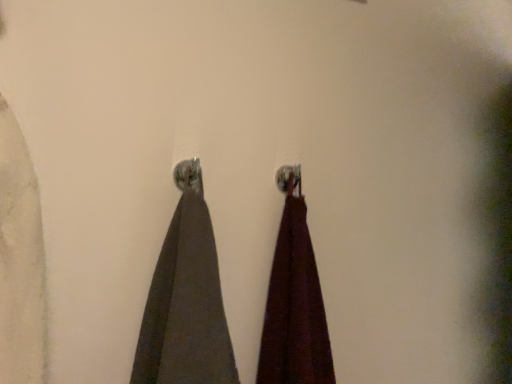
At what (x,y) coordinates should I click in order to perform the action: click on burgundy fabric at center, the 1th curtain viewed from the right. Please return your answer as a coordinate pair (x, y). This screenshot has height=384, width=512. Looking at the image, I should click on (294, 301).

What is the approximate height of burgundy fabric at center, the 1th curtain viewed from the right?

It is 47.63 centimeters.

Describe the element at coordinates (294, 301) in the screenshot. The height and width of the screenshot is (384, 512). I see `burgundy fabric at center, the second curtain in the left-to-right sequence` at that location.

What do you see at coordinates (186, 299) in the screenshot?
I see `dark gray fabric at center, acting as the second curtain starting from the right` at bounding box center [186, 299].

How much space does dark gray fabric at center, acting as the second curtain starting from the right, occupy horizontally?

dark gray fabric at center, acting as the second curtain starting from the right, is 4.98 inches wide.

Identify the location of dark gray fabric at center, acting as the second curtain starting from the right. (186, 299).

Where is `burgundy fabric at center, the second curtain in the left-to-right sequence`? This screenshot has width=512, height=384. burgundy fabric at center, the second curtain in the left-to-right sequence is located at coordinates (294, 301).

Considering the positions of objects dark gray fabric at center, acting as the second curtain starting from the right, and burgundy fabric at center, the 1th curtain viewed from the right, in the image provided, who is more to the left, dark gray fabric at center, acting as the second curtain starting from the right, or burgundy fabric at center, the 1th curtain viewed from the right,?

From the viewer's perspective, dark gray fabric at center, acting as the second curtain starting from the right, appears more on the left side.

Is the depth of dark gray fabric at center, acting as the second curtain starting from the right, greater than that of burgundy fabric at center, the 1th curtain viewed from the right?

No, it is in front of burgundy fabric at center, the 1th curtain viewed from the right.

Is point (177, 257) in front of point (323, 331)?

That is True.

From the image's perspective, is dark gray fabric at center, acting as the second curtain starting from the right, over burgundy fabric at center, the second curtain in the left-to-right sequence?

Yes, from the image's perspective, dark gray fabric at center, acting as the second curtain starting from the right, is on top of burgundy fabric at center, the second curtain in the left-to-right sequence.

From a real-world perspective, is dark gray fabric at center, acting as the second curtain starting from the right, physically above burgundy fabric at center, the second curtain in the left-to-right sequence?

Indeed, from a real-world perspective, dark gray fabric at center, acting as the second curtain starting from the right, stands above burgundy fabric at center, the second curtain in the left-to-right sequence.

Which of these two, dark gray fabric at center, acting as the second curtain starting from the right, or burgundy fabric at center, the second curtain in the left-to-right sequence, is thinner?

dark gray fabric at center, acting as the second curtain starting from the right, is thinner.

Which of these two, dark gray fabric at center, the first curtain in the left-to-right sequence, or burgundy fabric at center, the second curtain in the left-to-right sequence, stands taller?

Standing taller between the two is burgundy fabric at center, the second curtain in the left-to-right sequence.

Looking at this image, looking at the image, does dark gray fabric at center, acting as the second curtain starting from the right, seem bigger or smaller compared to burgundy fabric at center, the second curtain in the left-to-right sequence?

dark gray fabric at center, acting as the second curtain starting from the right, is bigger than burgundy fabric at center, the second curtain in the left-to-right sequence.

Is dark gray fabric at center, acting as the second curtain starting from the right, situated inside burgundy fabric at center, the second curtain in the left-to-right sequence, or outside?

The correct answer is: outside.

Consider the image. Can you see dark gray fabric at center, acting as the second curtain starting from the right, touching burgundy fabric at center, the 1th curtain viewed from the right?

No, dark gray fabric at center, acting as the second curtain starting from the right, is not next to burgundy fabric at center, the 1th curtain viewed from the right.

Is dark gray fabric at center, the first curtain in the left-to-right sequence, oriented away from burgundy fabric at center, the 1th curtain viewed from the right?

No, burgundy fabric at center, the 1th curtain viewed from the right, is not at the back of dark gray fabric at center, the first curtain in the left-to-right sequence.

Can you tell me how much dark gray fabric at center, the first curtain in the left-to-right sequence, and burgundy fabric at center, the second curtain in the left-to-right sequence, differ in facing direction?

0.00046 degrees separate the facing orientations of dark gray fabric at center, the first curtain in the left-to-right sequence, and burgundy fabric at center, the second curtain in the left-to-right sequence.

Locate an element on the screen. This screenshot has width=512, height=384. curtain below the dark gray fabric at center, acting as the second curtain starting from the right (from the image's perspective) is located at coordinates (294, 301).

Between burgundy fabric at center, the second curtain in the left-to-right sequence, and dark gray fabric at center, acting as the second curtain starting from the right, which one appears on the left side from the viewer's perspective?

From the viewer's perspective, dark gray fabric at center, acting as the second curtain starting from the right, appears more on the left side.

Who is more distant, burgundy fabric at center, the 1th curtain viewed from the right, or dark gray fabric at center, the first curtain in the left-to-right sequence?

Positioned behind is burgundy fabric at center, the 1th curtain viewed from the right.

Does point (295, 322) appear closer or farther from the camera than point (177, 365)?

Point (295, 322).

From the image's perspective, which one is positioned lower, burgundy fabric at center, the 1th curtain viewed from the right, or dark gray fabric at center, the first curtain in the left-to-right sequence?

burgundy fabric at center, the 1th curtain viewed from the right, appears lower in the image.

From a real-world perspective, is burgundy fabric at center, the 1th curtain viewed from the right, physically below dark gray fabric at center, acting as the second curtain starting from the right?

Correct, in the physical world, burgundy fabric at center, the 1th curtain viewed from the right, is lower than dark gray fabric at center, acting as the second curtain starting from the right.

Considering the relative sizes of burgundy fabric at center, the second curtain in the left-to-right sequence, and dark gray fabric at center, acting as the second curtain starting from the right, in the image provided, is burgundy fabric at center, the second curtain in the left-to-right sequence, thinner than dark gray fabric at center, acting as the second curtain starting from the right,?

In fact, burgundy fabric at center, the second curtain in the left-to-right sequence, might be wider than dark gray fabric at center, acting as the second curtain starting from the right.

Can you confirm if burgundy fabric at center, the second curtain in the left-to-right sequence, is shorter than dark gray fabric at center, the first curtain in the left-to-right sequence?

No, burgundy fabric at center, the second curtain in the left-to-right sequence, is not shorter than dark gray fabric at center, the first curtain in the left-to-right sequence.

Who is bigger, burgundy fabric at center, the second curtain in the left-to-right sequence, or dark gray fabric at center, the first curtain in the left-to-right sequence?

dark gray fabric at center, the first curtain in the left-to-right sequence, is bigger.

Is burgundy fabric at center, the 1th curtain viewed from the right, outside of dark gray fabric at center, acting as the second curtain starting from the right?

Indeed, burgundy fabric at center, the 1th curtain viewed from the right, is completely outside dark gray fabric at center, acting as the second curtain starting from the right.

Is burgundy fabric at center, the 1th curtain viewed from the right, far from dark gray fabric at center, acting as the second curtain starting from the right?

No, burgundy fabric at center, the 1th curtain viewed from the right, is in close proximity to dark gray fabric at center, acting as the second curtain starting from the right.

Is burgundy fabric at center, the second curtain in the left-to-right sequence, turned away from dark gray fabric at center, the first curtain in the left-to-right sequence?

No.

How many degrees apart are the facing directions of burgundy fabric at center, the 1th curtain viewed from the right, and dark gray fabric at center, acting as the second curtain starting from the right?

The angular difference between burgundy fabric at center, the 1th curtain viewed from the right, and dark gray fabric at center, acting as the second curtain starting from the right, is 0.00046 degrees.

Locate an element on the screen. curtain in front of the burgundy fabric at center, the 1th curtain viewed from the right is located at coordinates (186, 299).

Locate an element on the screen. This screenshot has width=512, height=384. curtain below the dark gray fabric at center, acting as the second curtain starting from the right (from the image's perspective) is located at coordinates (294, 301).

At what (x,y) coordinates should I click in order to perform the action: click on curtain to the right of dark gray fabric at center, the first curtain in the left-to-right sequence. Please return your answer as a coordinate pair (x, y). This screenshot has height=384, width=512. Looking at the image, I should click on (294, 301).